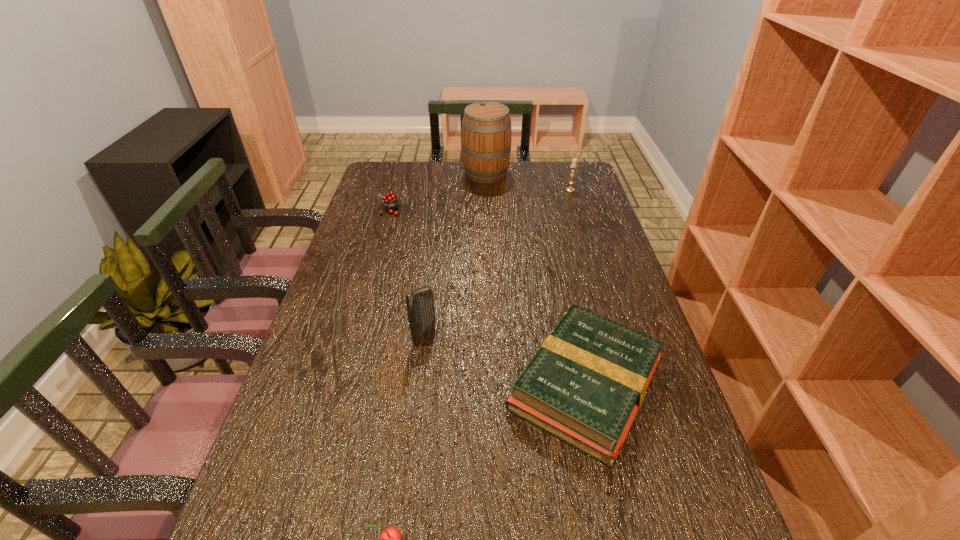
You are a GUI agent. You are given a task and a screenshot of the screen. Output one action in this format:
    pyautogui.click(x=<x>, y=<y>)
    Task: Click on the free region at the right edge
    
    Given the screenshot: What is the action you would take?
    pyautogui.click(x=572, y=193)

Image resolution: width=960 pixels, height=540 pixels. Find the location of `vacant space at the far left corner`. vacant space at the far left corner is located at coordinates (412, 163).

What are the coordinates of `free space at the far right corner of the desktop` in the screenshot? It's located at (558, 163).

Image resolution: width=960 pixels, height=540 pixels. I want to click on free area in between the farther cherry and the fifth shortest object, so click(x=406, y=273).

The width and height of the screenshot is (960, 540). Identify the location of unoccupied area between the farthest object and the leftmost object. (437, 191).

Locate an element on the screen. free space between the cider and the hardback book is located at coordinates (536, 279).

This screenshot has height=540, width=960. I want to click on free spot between the hardback book and the farthest object, so click(536, 279).

Locate an element on the screen. Image resolution: width=960 pixels, height=540 pixels. free spot between the cider and the second farthest object is located at coordinates (528, 181).

Find the location of a particular element. free area in between the fourth shortest object and the left cherry is located at coordinates click(x=479, y=200).

Identify which object is the third closest to the hardback book. Please provide its 2D coordinates. Your answer should be formatted as a tuple, i.e. [(x, y)], where the tuple contains the x and y coordinates of a point satisfying the conditions above.

[(390, 202)]